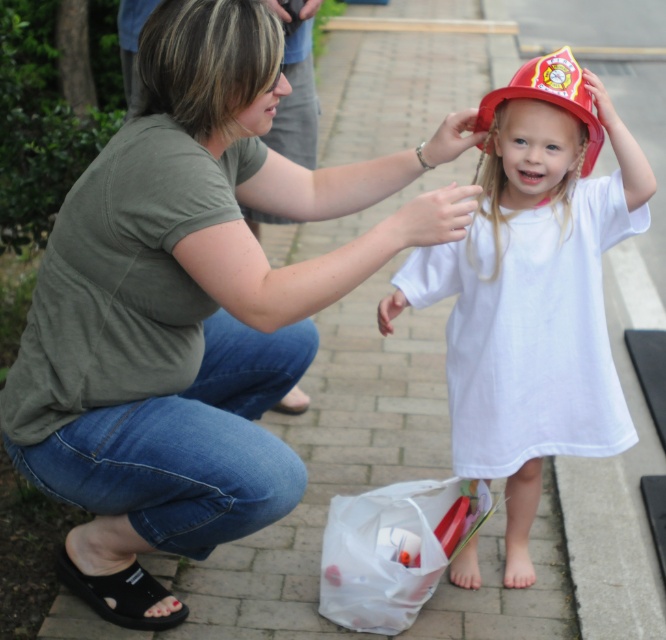
Question: Does matte green shirt at center lie in front of pale skin at upper center?

Choices:
 (A) no
 (B) yes

Answer: (B)

Question: Which of the following is the farthest from the observer?

Choices:
 (A) (153, 604)
 (B) (583, 83)

Answer: (A)

Question: Does matte red fire helmet at center appear over black rubber sandal at lower left?

Choices:
 (A) no
 (B) yes

Answer: (B)

Question: Which point is farther to the camera?

Choices:
 (A) black rubber sandal at lower left
 (B) matte red hat at upper center

Answer: (A)

Question: Does matte green shirt at center have a smaller size compared to matte red hat at upper center?

Choices:
 (A) no
 (B) yes

Answer: (A)

Question: Which object appears closest to the camera in this image?

Choices:
 (A) matte red fire helmet at center
 (B) pale skin at upper center
 (C) red matte fire helmet at upper center

Answer: (B)